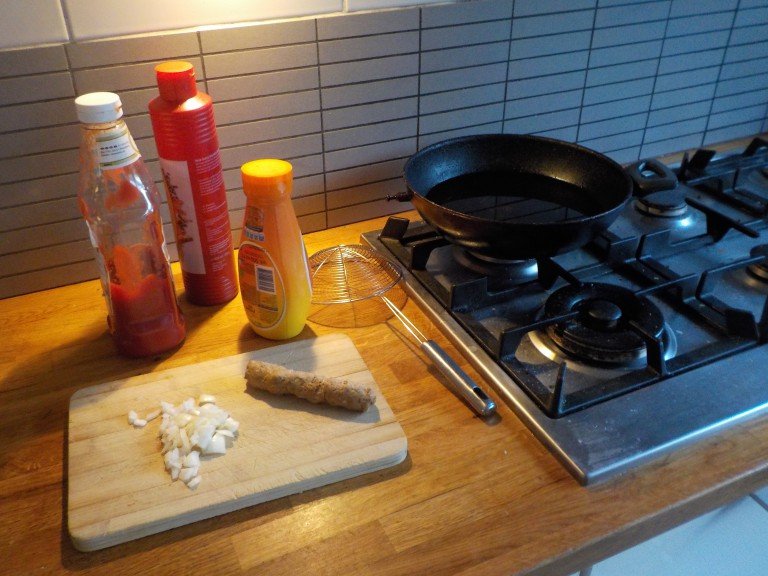
At what (x,y) coordinates should I click in order to perform the action: click on bottle. Please return your answer as a coordinate pair (x, y). This screenshot has width=768, height=576. Looking at the image, I should click on (187, 147).